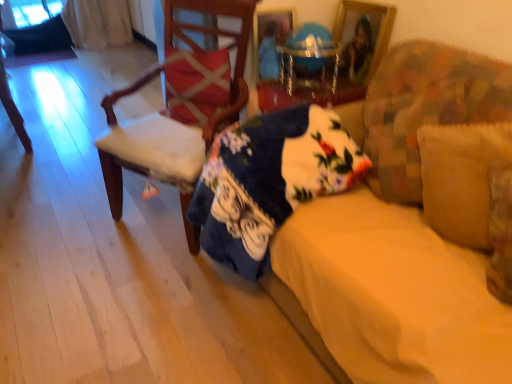
This screenshot has width=512, height=384. I want to click on vacant area that is in front of wooden chair at left, which appears as the second chair when viewed from the left, so click(x=108, y=280).